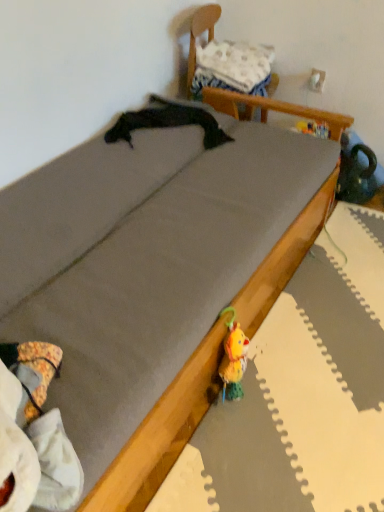
From the picture: In order to face white fabric pillow at upper center, should I rotate leftwards or rightwards?

A 5.989 degree turn to the right will do.

Describe the element at coordinates (233, 66) in the screenshot. I see `white fabric pillow at upper center` at that location.

At what (x,y) coordinates should I click in order to perform the action: click on white fabric pillow at upper center. Please return your answer as a coordinate pair (x, y). Image resolution: width=384 pixels, height=512 pixels. Looking at the image, I should click on (233, 66).

Measure the distance between point (188, 75) and camera.

The distance of point (188, 75) from camera is 1.99 meters.

This screenshot has width=384, height=512. What are the coordinates of `wooden chair at upper center` in the screenshot? It's located at (200, 34).

This screenshot has width=384, height=512. Describe the element at coordinates (200, 34) in the screenshot. I see `wooden chair at upper center` at that location.

Where is `white fabric pillow at upper center`? The width and height of the screenshot is (384, 512). white fabric pillow at upper center is located at coordinates (233, 66).

Can you confirm if white fabric pillow at upper center is positioned to the right of wooden chair at upper center?

In fact, white fabric pillow at upper center is to the left of wooden chair at upper center.

Considering the positions of objects white fabric pillow at upper center and wooden chair at upper center in the image provided, who is behind, white fabric pillow at upper center or wooden chair at upper center?

white fabric pillow at upper center is further away from the camera.

Is point (239, 55) behind point (222, 105)?

Yes, point (239, 55) is farther from viewer.

From the image's perspective, is white fabric pillow at upper center below wooden chair at upper center?

Incorrect, from the image's perspective, white fabric pillow at upper center is higher than wooden chair at upper center.

From a real-world perspective, is white fabric pillow at upper center physically below wooden chair at upper center?

No, from a real-world perspective, white fabric pillow at upper center is not beneath wooden chair at upper center.

In terms of width, does white fabric pillow at upper center look wider or thinner when compared to wooden chair at upper center?

Considering their sizes, white fabric pillow at upper center looks slimmer than wooden chair at upper center.

Can you confirm if white fabric pillow at upper center is shorter than wooden chair at upper center?

Indeed, white fabric pillow at upper center has a lesser height compared to wooden chair at upper center.

Looking at the image, does white fabric pillow at upper center seem bigger or smaller compared to wooden chair at upper center?

Clearly, white fabric pillow at upper center is smaller in size than wooden chair at upper center.

Is white fabric pillow at upper center positioned beyond the bounds of wooden chair at upper center?

No.

Is white fabric pillow at upper center positioned far away from wooden chair at upper center?

No.

Consider the image. Is white fabric pillow at upper center facing towards wooden chair at upper center?

Yes, white fabric pillow at upper center is turned towards wooden chair at upper center.

How many degrees apart are the facing directions of white fabric pillow at upper center and wooden chair at upper center?

There is a 5.86-degree angle between the facing directions of white fabric pillow at upper center and wooden chair at upper center.

Measure the distance between white fabric pillow at upper center and wooden chair at upper center.

A distance of 6.62 inches exists between white fabric pillow at upper center and wooden chair at upper center.

Where is `pillow above the wooden chair at upper center (from the image's perspective)`? The width and height of the screenshot is (384, 512). pillow above the wooden chair at upper center (from the image's perspective) is located at coordinates (233, 66).

Looking at this image, is wooden chair at upper center to the left or to the right of white fabric pillow at upper center in the image?

Clearly, wooden chair at upper center is on the right of white fabric pillow at upper center in the image.

Between wooden chair at upper center and white fabric pillow at upper center, which one is positioned behind?

white fabric pillow at upper center.

Which is closer to the camera, (250, 112) or (207, 83)?

Point (250, 112)

From the image's perspective, who appears lower, wooden chair at upper center or white fabric pillow at upper center?

wooden chair at upper center is shown below in the image.

From a real-world perspective, is wooden chair at upper center physically below white fabric pillow at upper center?

Yes.

Is wooden chair at upper center wider than white fabric pillow at upper center?

Correct, the width of wooden chair at upper center exceeds that of white fabric pillow at upper center.

Which of these two, wooden chair at upper center or white fabric pillow at upper center, stands taller?

Standing taller between the two is wooden chair at upper center.

Between wooden chair at upper center and white fabric pillow at upper center, which one has larger size?

wooden chair at upper center.

Would you say wooden chair at upper center is outside white fabric pillow at upper center?

Yes, wooden chair at upper center is outside of white fabric pillow at upper center.

Based on the photo, would you say wooden chair at upper center is a long distance from white fabric pillow at upper center?

No, wooden chair at upper center is not far away from white fabric pillow at upper center.

Is wooden chair at upper center facing towards white fabric pillow at upper center?

Yes, wooden chair at upper center is turned towards white fabric pillow at upper center.

Identify the location of pillow on the left of the wooden chair at upper center. point(233,66).

Where is `furniture below the white fabric pillow at upper center (from a real-world perspective)`? This screenshot has height=512, width=384. furniture below the white fabric pillow at upper center (from a real-world perspective) is located at coordinates (200, 34).

Identify the location of pillow above the wooden chair at upper center (from a real-world perspective). [233, 66].